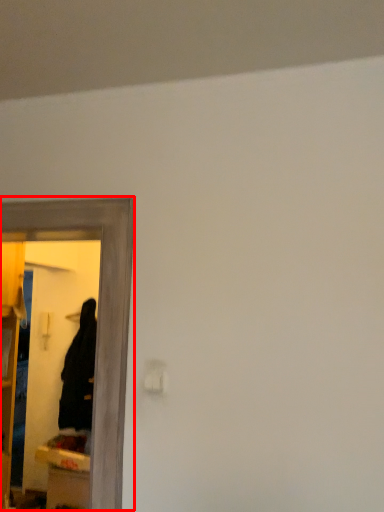
Question: From the image's perspective, where is mirror (annotated by the red box) located relative to robe?

Choices:
 (A) above
 (B) below

Answer: (A)